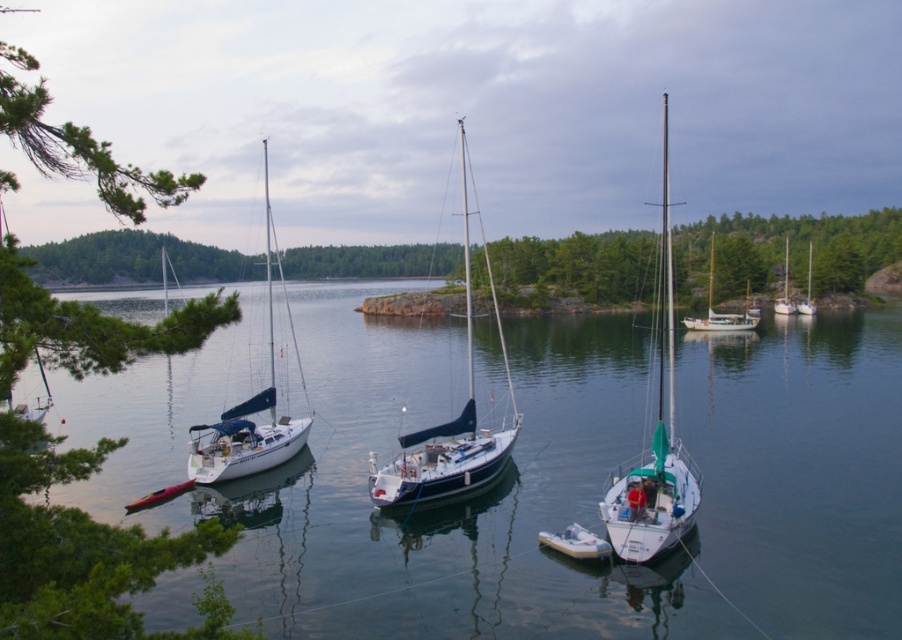
Question: Is green leafy tree at upper center wider than white glossy sailboat at center?

Choices:
 (A) yes
 (B) no

Answer: (A)

Question: Does white glossy sailboat at center have a smaller size compared to white rubber dinghy at center?

Choices:
 (A) yes
 (B) no

Answer: (B)

Question: Which of the following is the farthest from the observer?

Choices:
 (A) white glossy sailboat at center
 (B) clear water at center

Answer: (A)

Question: Which object appears farthest from the camera in this image?

Choices:
 (A) clear water at center
 (B) blue glossy sailboat at center

Answer: (B)

Question: Considering the relative positions of wooden sailboat at center and white glossy sailboat at right in the image provided, where is wooden sailboat at center located with respect to white glossy sailboat at right?

Choices:
 (A) below
 (B) above

Answer: (A)

Question: Among these points, which one is nearest to the camera?

Choices:
 (A) (787, 257)
 (B) (670, 474)
 (C) (385, 470)
 (D) (274, 257)

Answer: (B)